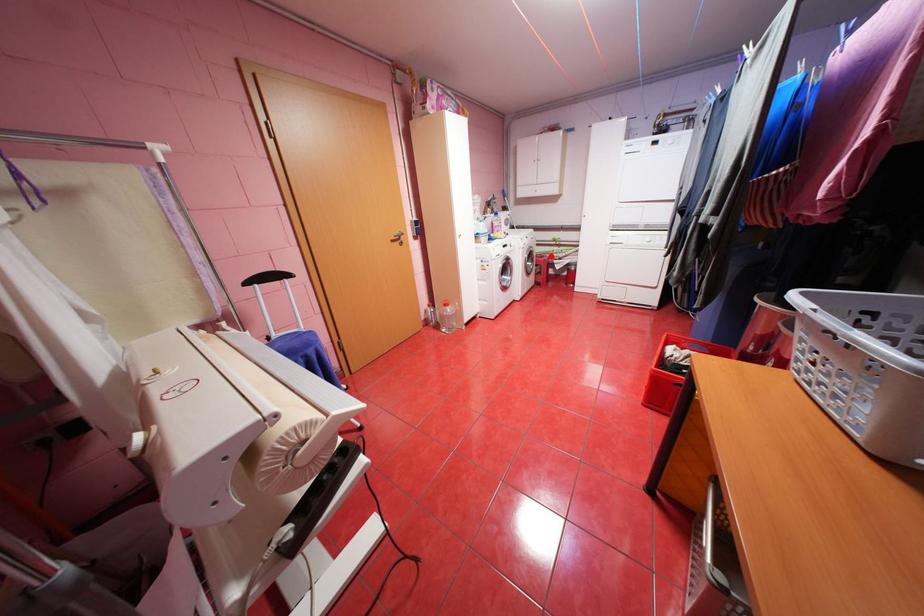
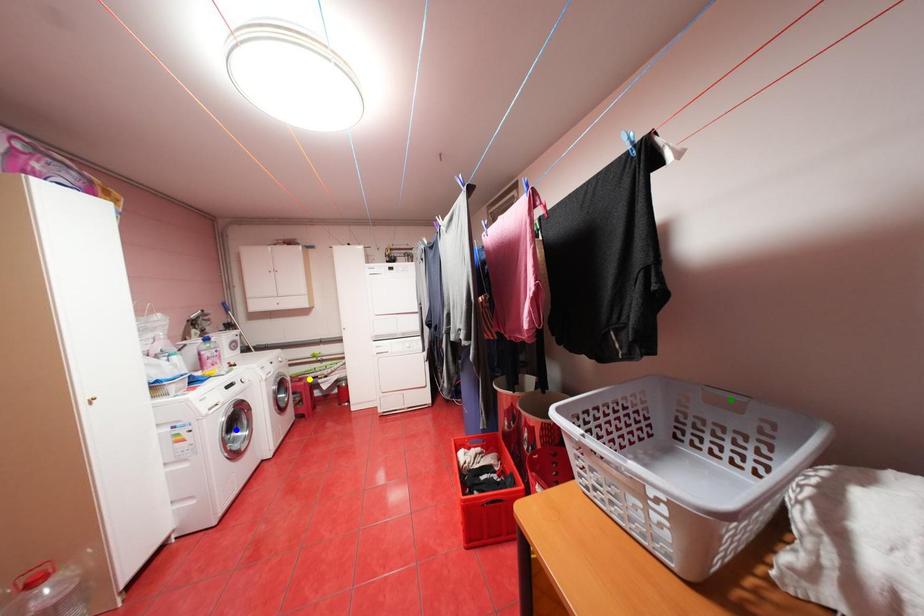
Question: I am providing you with two images of the same scene from different viewpoints. A red point is marked on the first image. You are given multiple points on the second image. Which point in image 2 is actually the same real-world point as the red point in image 1?

Choices:
 (A) blue point
 (B) green point
 (C) yellow point

Answer: (C)